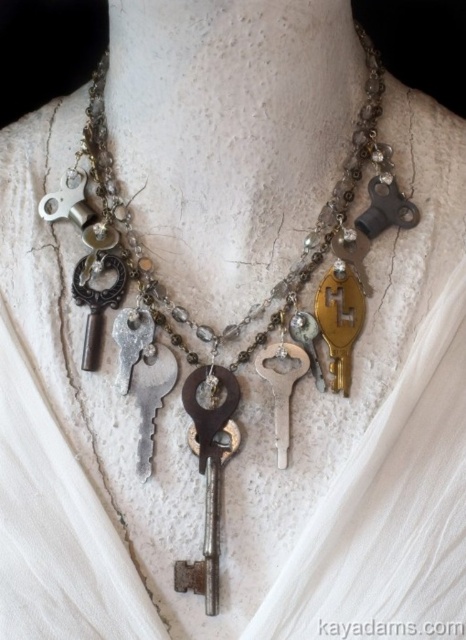
Question: Which point appears farthest from the camera in this image?

Choices:
 (A) (107, 170)
 (B) (273, 356)
 (C) (347, 308)

Answer: (A)

Question: Which is farther from the silver metallic key at center?

Choices:
 (A) gold metallic key at center
 (B) antique silver keys at center

Answer: (B)

Question: Does gold metallic key at center appear under silver metallic key at center?

Choices:
 (A) yes
 (B) no

Answer: (B)

Question: Does rusty metal key at center have a larger size compared to silver metallic key at center?

Choices:
 (A) no
 (B) yes

Answer: (B)

Question: Which of the following is the closest to the observer?

Choices:
 (A) antique silver keys at center
 (B) rusty metal key at center
 (C) silver metallic key at center

Answer: (B)

Question: Does antique silver keys at center have a greater width compared to silver metallic key at center?

Choices:
 (A) yes
 (B) no

Answer: (A)